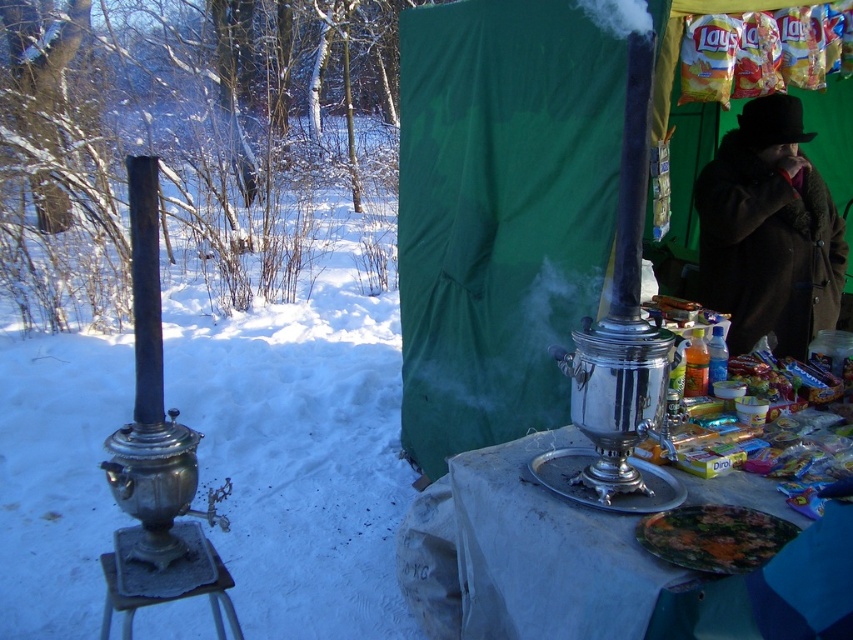
You are organizing a winter event and need to know which samovar is on top. Given the setup of the shiny metallic samovar at center and the shiny silver samovar at center, which one is placed above the other?

The shiny metallic samovar at center is positioned over the shiny silver samovar at center, so it is the one on top.

You are a guest at a winter gathering and want to place your brown woolen coat at right on the table where the shiny silver samovar at center is located. Will the coat fit on the table without overlapping the samovar?

The shiny silver samovar at center has a lesser height compared to brown woolen coat at right. Since the coat is taller, it might not fit on the table without overlapping the samovar, but the question is about placement on the table, not height. The description only mentions height difference, so the answer should focus on height. Since the coat is taller, it might not fit vertically, but if the table has enough space horizontally, it could. However, the given info only states height, so the answer should

You are standing at the center of the image. Where is the shiny metallic samovar at center located relative to your position?

The shiny metallic samovar at center is located at point (498, 212) relative to the image center.